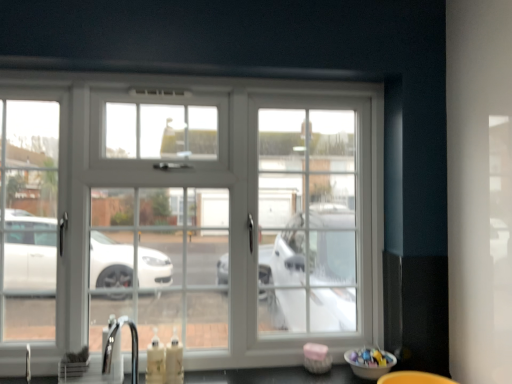
The image size is (512, 384). What are the coordinates of `satin nickel faucet at lower left` in the screenshot? It's located at (113, 345).

The width and height of the screenshot is (512, 384). What do you see at coordinates (113, 345) in the screenshot?
I see `satin nickel faucet at lower left` at bounding box center [113, 345].

The width and height of the screenshot is (512, 384). Find the location of `white glossy window at center`. white glossy window at center is located at coordinates (189, 215).

Image resolution: width=512 pixels, height=384 pixels. What do you see at coordinates (189, 215) in the screenshot? I see `white glossy window at center` at bounding box center [189, 215].

Find the location of a particular element. Image resolution: width=512 pixels, height=384 pixels. satin nickel faucet at lower left is located at coordinates (113, 345).

Considering the positions of objects satin nickel faucet at lower left and white glossy window at center in the image provided, who is more to the left, satin nickel faucet at lower left or white glossy window at center?

Positioned to the left is satin nickel faucet at lower left.

Is satin nickel faucet at lower left positioned behind white glossy window at center?

No, it is not.

Is point (122, 322) closer to camera compared to point (106, 113)?

Yes.

From the image's perspective, which is below, satin nickel faucet at lower left or white glossy window at center?

From the image's view, satin nickel faucet at lower left is below.

From a real-world perspective, which is physically below, satin nickel faucet at lower left or white glossy window at center?

In real-world perspective, satin nickel faucet at lower left is lower.

Can you confirm if satin nickel faucet at lower left is thinner than white glossy window at center?

Indeed, satin nickel faucet at lower left has a lesser width compared to white glossy window at center.

Between satin nickel faucet at lower left and white glossy window at center, which one has more height?

white glossy window at center.

Which of these two, satin nickel faucet at lower left or white glossy window at center, is bigger?

white glossy window at center.

Is satin nickel faucet at lower left not inside white glossy window at center?

Yes, satin nickel faucet at lower left is located beyond the bounds of white glossy window at center.

Would you say satin nickel faucet at lower left is a long distance from white glossy window at center?

Actually, satin nickel faucet at lower left and white glossy window at center are a little close together.

Could you tell me if satin nickel faucet at lower left is facing white glossy window at center?

No, satin nickel faucet at lower left is not oriented towards white glossy window at center.

What are the coordinates of `faucet that is on the left side of white glossy window at center` in the screenshot? It's located at (113, 345).

Which is more to the right, white glossy window at center or satin nickel faucet at lower left?

white glossy window at center.

Between white glossy window at center and satin nickel faucet at lower left, which one is positioned in front?

satin nickel faucet at lower left is in front.

Considering the positions of point (172, 192) and point (131, 327), is point (172, 192) closer or farther from the camera than point (131, 327)?

Point (172, 192) is farther from the camera than point (131, 327).

From the image's perspective, who appears lower, white glossy window at center or satin nickel faucet at lower left?

satin nickel faucet at lower left is shown below in the image.

From a real-world perspective, does white glossy window at center stand above satin nickel faucet at lower left?

Yes, from a real-world perspective, white glossy window at center is above satin nickel faucet at lower left.

Considering the relative sizes of white glossy window at center and satin nickel faucet at lower left in the image provided, is white glossy window at center thinner than satin nickel faucet at lower left?

In fact, white glossy window at center might be wider than satin nickel faucet at lower left.

Considering the sizes of objects white glossy window at center and satin nickel faucet at lower left in the image provided, who is shorter, white glossy window at center or satin nickel faucet at lower left?

satin nickel faucet at lower left.

Who is smaller, white glossy window at center or satin nickel faucet at lower left?

satin nickel faucet at lower left.

Is white glossy window at center not inside satin nickel faucet at lower left?

Yes, white glossy window at center is located beyond the bounds of satin nickel faucet at lower left.

Is there a large distance between white glossy window at center and satin nickel faucet at lower left?

That's not correct — white glossy window at center is a little close to satin nickel faucet at lower left.

Is white glossy window at center facing towards satin nickel faucet at lower left?

Yes, white glossy window at center is turned towards satin nickel faucet at lower left.

Can you tell me how much white glossy window at center and satin nickel faucet at lower left differ in facing direction?

The angular difference between white glossy window at center and satin nickel faucet at lower left is 1.49 degrees.

How far apart are white glossy window at center and satin nickel faucet at lower left?

white glossy window at center and satin nickel faucet at lower left are 57.66 centimeters apart.

Find the location of a particular element. The width and height of the screenshot is (512, 384). faucet lying on the left of white glossy window at center is located at coordinates (113, 345).

Identify the location of window above the satin nickel faucet at lower left (from a real-world perspective). Image resolution: width=512 pixels, height=384 pixels. (189, 215).

Locate an element on the screen. This screenshot has height=384, width=512. faucet in front of the white glossy window at center is located at coordinates (113, 345).